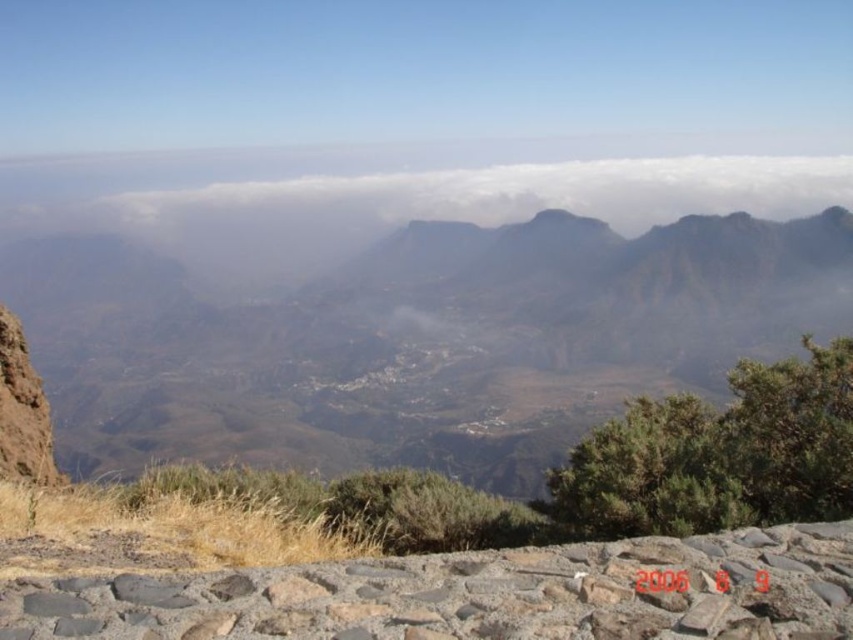
Question: Can you confirm if gray/rough stone at lower center is bigger than white fluffy cloud at center?

Choices:
 (A) yes
 (B) no

Answer: (B)

Question: Which object appears farthest from the camera in this image?

Choices:
 (A) white fluffy cloud at center
 (B) rugged rock mountain at center
 (C) gray/rough stone at lower center

Answer: (A)

Question: Is rugged rock mountain at center thinner than white fluffy cloud at center?

Choices:
 (A) no
 (B) yes

Answer: (B)

Question: Which point is farther to the camera?

Choices:
 (A) white fluffy cloud at center
 (B) gray/rough stone at lower center

Answer: (A)

Question: Which point is farther from the camera taking this photo?

Choices:
 (A) (801, 612)
 (B) (119, 356)

Answer: (B)

Question: From the image, what is the correct spatial relationship of rugged rock mountain at center in relation to white fluffy cloud at center?

Choices:
 (A) left
 (B) right

Answer: (A)